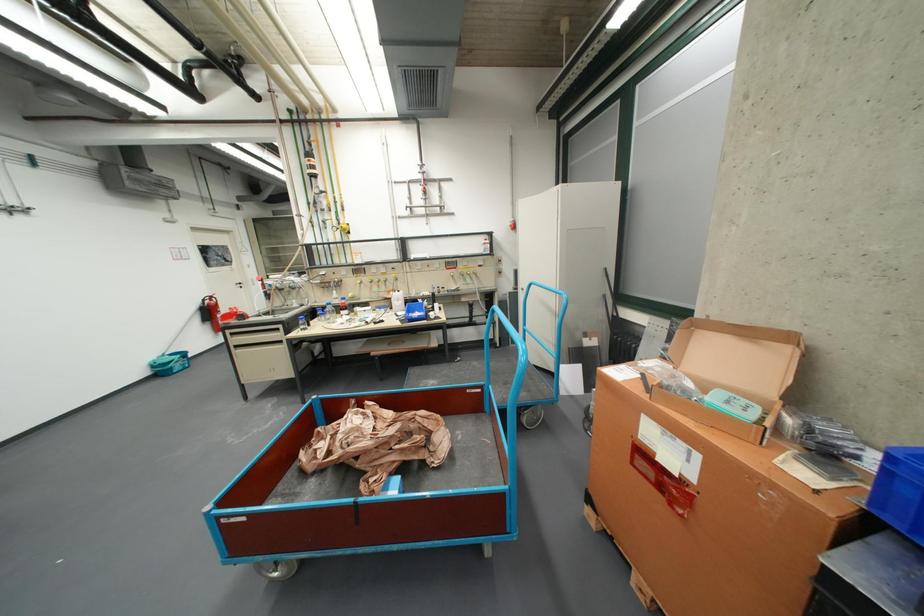
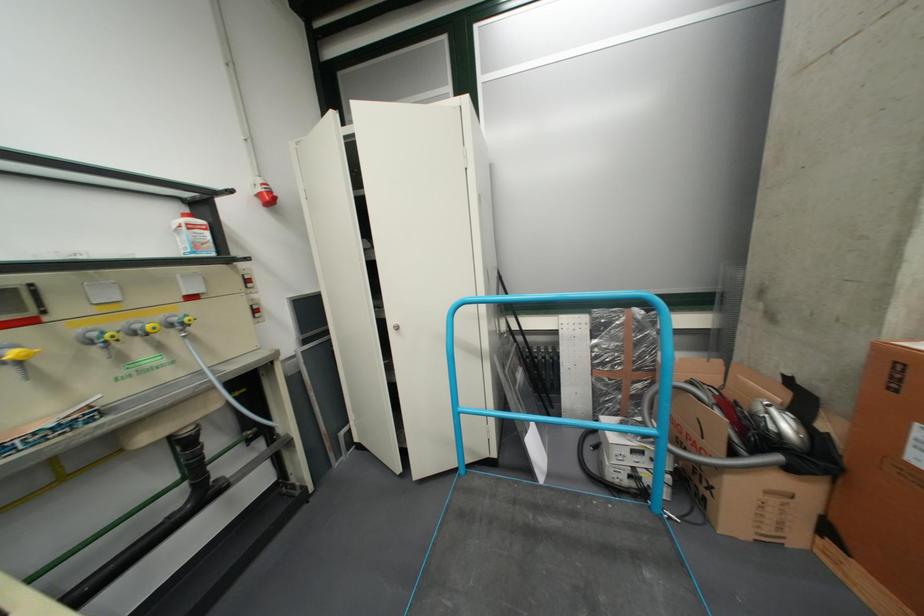
Where in the second image is the point corresponding to point 496,251 from the first image?

(208, 246)